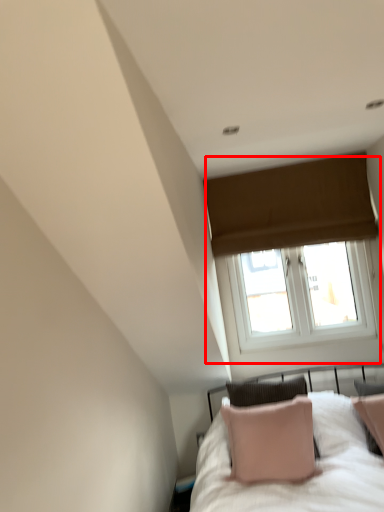
Question: From the image's perspective, what is the correct spatial relationship of window (annotated by the red box) in relation to bed?

Choices:
 (A) above
 (B) below

Answer: (A)